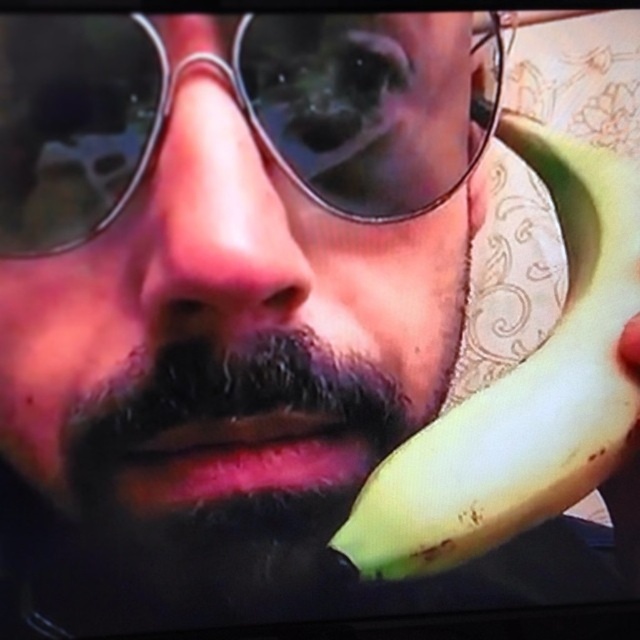
Who is higher up, matte black sunglasses at center or yellow matte banana at right?

matte black sunglasses at center

Which of these two, matte black sunglasses at center or yellow matte banana at right, stands shorter?

With less height is yellow matte banana at right.

The height and width of the screenshot is (640, 640). Identify the location of matte black sunglasses at center. (228, 266).

Can you confirm if matte black sunglasses at center is bigger than metallic round sunglasses at center?

Yes.

Is matte black sunglasses at center further to camera compared to metallic round sunglasses at center?

That is True.

Between point (266, 381) and point (365, 154), which one is positioned behind?

The point (266, 381) is behind.

Where is `matte black sunglasses at center`? matte black sunglasses at center is located at coordinates (228, 266).

Between metallic round sunglasses at center and yellow matte banana at right, which one appears on the left side from the viewer's perspective?

metallic round sunglasses at center

The width and height of the screenshot is (640, 640). Describe the element at coordinates (243, 112) in the screenshot. I see `metallic round sunglasses at center` at that location.

You are a GUI agent. You are given a task and a screenshot of the screen. Output one action in this format:
    pyautogui.click(x=<x>, y=<y>)
    Task: Click on the metallic round sunglasses at center
    
    Given the screenshot: What is the action you would take?
    pyautogui.click(x=243, y=112)